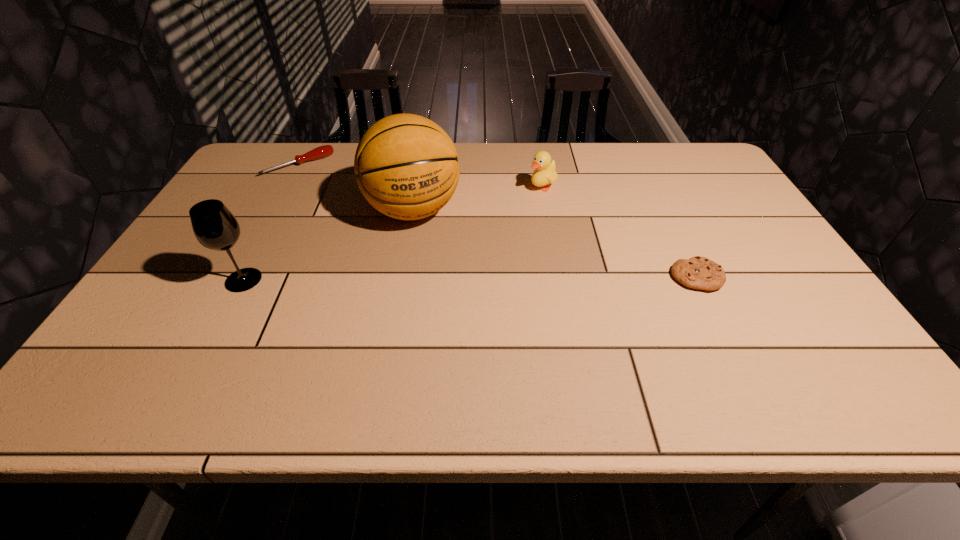
In order to click on vacant area that lies between the wineglass and the farthest object in this screenshot , I will do `click(272, 222)`.

I want to click on vacant region between the fourth shortest object and the farthest object, so click(272, 222).

What are the coordinates of `vacant space in between the shortest object and the screwdriver` in the screenshot? It's located at (498, 221).

This screenshot has width=960, height=540. I want to click on free space between the farthest object and the second tallest object, so click(x=272, y=222).

What are the coordinates of `free space between the wineglass and the third shortest object` in the screenshot? It's located at (393, 234).

Identify the location of free spot between the screwdriver and the wineglass. The width and height of the screenshot is (960, 540). (272, 222).

You are a GUI agent. You are given a task and a screenshot of the screen. Output one action in this format:
    pyautogui.click(x=<x>, y=<y>)
    Task: Click on the free spot between the shortest object and the screwdriver
    The height and width of the screenshot is (540, 960).
    Given the screenshot: What is the action you would take?
    pyautogui.click(x=498, y=221)

In order to click on the third closest object to the second tallest object in this screenshot , I will do `click(545, 170)`.

Identify which object is located as the nearest to the shortest object. Please provide its 2D coordinates. Your answer should be formatted as a tuple, i.e. [(x, y)], where the tuple contains the x and y coordinates of a point satisfying the conditions above.

[(545, 170)]

Locate an element on the screen. free space that satisfies the following two spatial constraints: 1. on the back side of the second tallest object; 2. on the left side of the cookie is located at coordinates (245, 276).